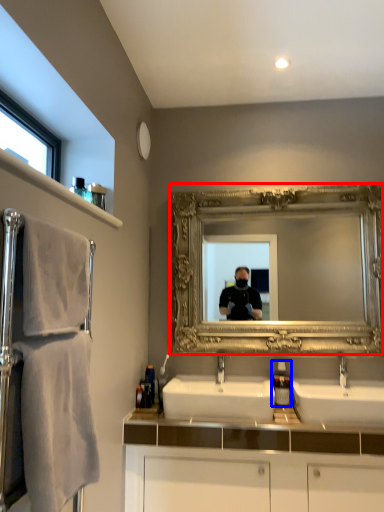
Question: Which object is further to the camera taking this photo, mirror (highlighted by a red box) or soap dispenser (highlighted by a blue box)?

Choices:
 (A) mirror
 (B) soap dispenser

Answer: (B)